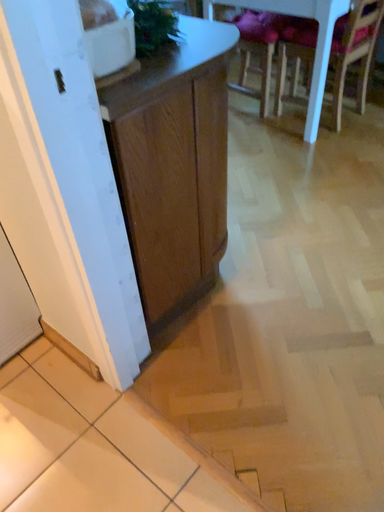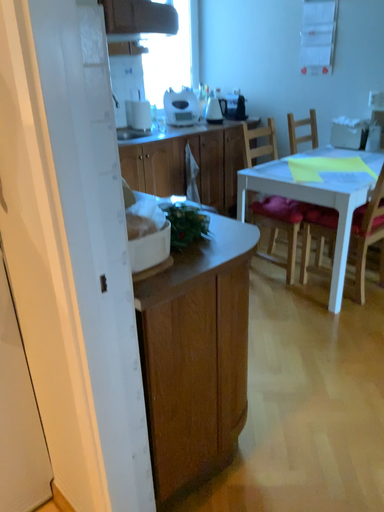
Question: Which way did the camera rotate in the video?

Choices:
 (A) rotated downward
 (B) rotated upward

Answer: (B)